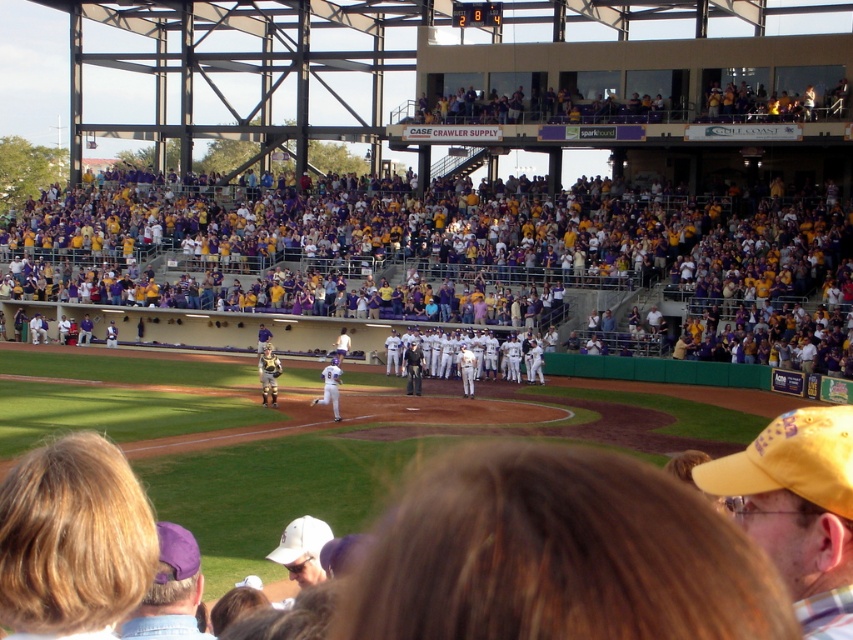
You are a photographer at the baseball game and want to capture a photo of the white matte baseball player at center without the gold metallic helmet at center blocking the view. Can you adjust your position to do so?

The white matte baseball player at center is behind the gold metallic helmet at center, so moving your position to the side or forward might allow you to see the player without the helmet blocking the view.

You are a photographer standing at the edge of the field. You want to take a photo of both the gold metallic helmet at center and the white matte baseball player at center without any obstruction. Given that your camera has a minimum focus distance of 1.5 meters, will you be able to capture both subjects clearly in the same frame?

The distance between the gold metallic helmet at center and the white matte baseball player at center is 1.73 meters. Since your camera requires a minimum focus distance of 1.5 meters, the 1.73 meters is sufficient to allow both subjects to be in focus and clearly captured in the same frame.